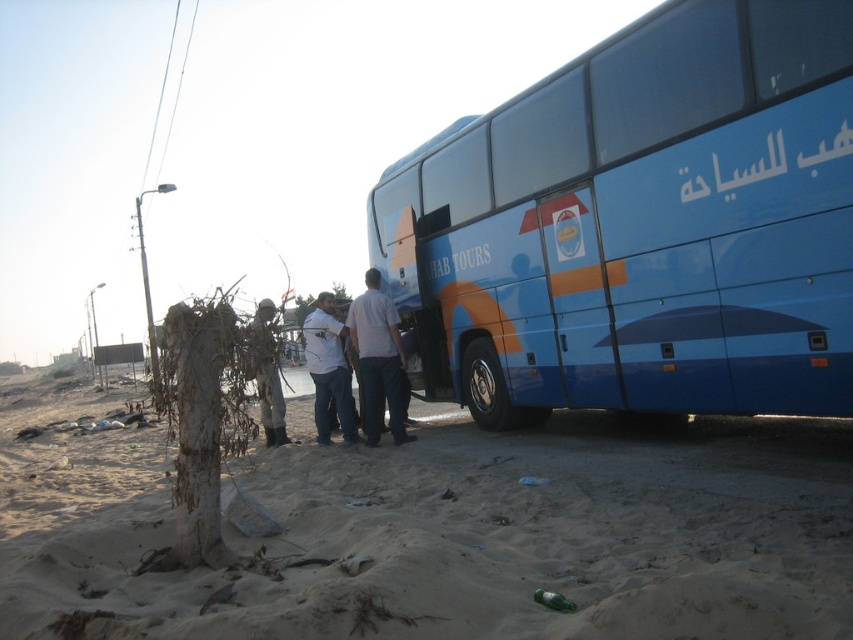
You are a photographer trying to capture a group photo of the two people in the scene. The subjects are wearing a white cotton shirt at center and a camouflage fabric figure at center. Since both are at the center, how can you position them so that their shirts are clearly visible in the photo?

Position the white cotton shirt at center to the right of the camouflage fabric figure at center so that their shirts do not overlap and are clearly visible.

You are a photographer trying to capture the blue glossy bus at right and the white matte shirt at center in the same frame. Considering their sizes, which object should you focus on first to ensure both are in focus?

The blue glossy bus at right is larger than the white matte shirt at center, so you should focus on the blue glossy bus at right first to ensure both are in focus.